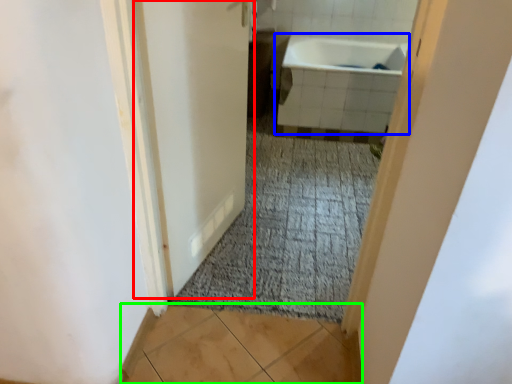
Question: Which object is positioned closest to door (highlighted by a red box)? Select from bathtub (highlighted by a blue box) and tile (highlighted by a green box).

Choices:
 (A) bathtub
 (B) tile

Answer: (B)